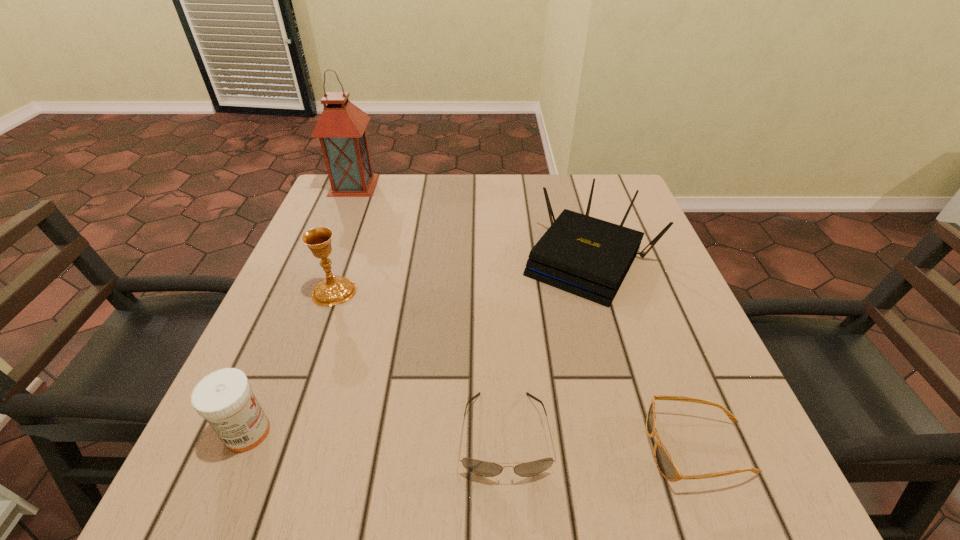
Locate an element on the screen. The width and height of the screenshot is (960, 540). vacant area between the medicine and the right sunglasses is located at coordinates (473, 440).

Find the location of a particular element. Image resolution: width=960 pixels, height=540 pixels. empty space between the chalice and the router is located at coordinates (462, 275).

I want to click on object that ranks as the second closest to the medicine, so click(482, 468).

Find the location of a particular element. object that is the fourth closest to the left sunglasses is located at coordinates (333, 290).

Identify the location of free spot that satisfies the following two spatial constraints: 1. on the back side of the chalice; 2. on the right side of the router. (346, 260).